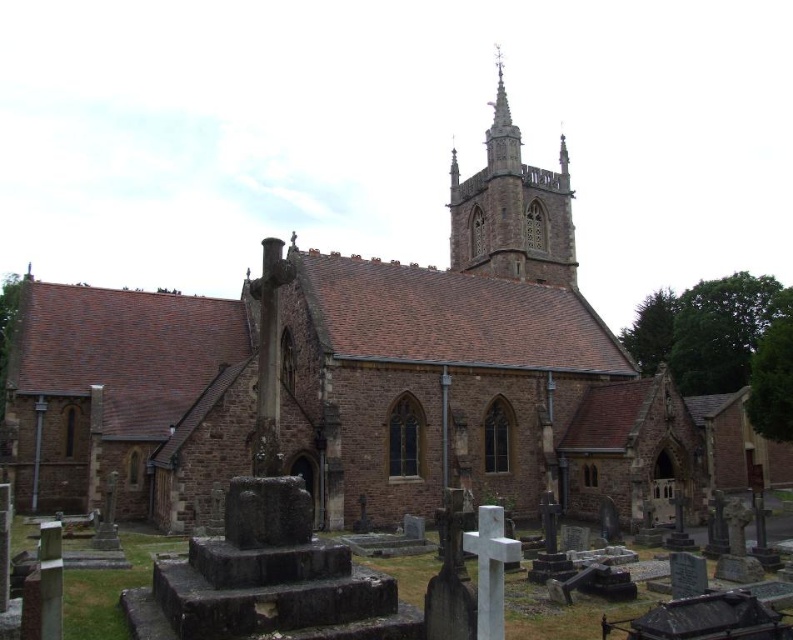
Is rusty stone tombstone at lower center bigger than smooth stone tower at upper center?

No, rusty stone tombstone at lower center is not bigger than smooth stone tower at upper center.

Does rusty stone tombstone at lower center come in front of smooth stone tower at upper center?

Yes, it is.

Does point (397, 630) come farther from viewer compared to point (477, 259)?

No, (397, 630) is closer to viewer.

The width and height of the screenshot is (793, 640). I want to click on rusty stone tombstone at lower center, so click(299, 582).